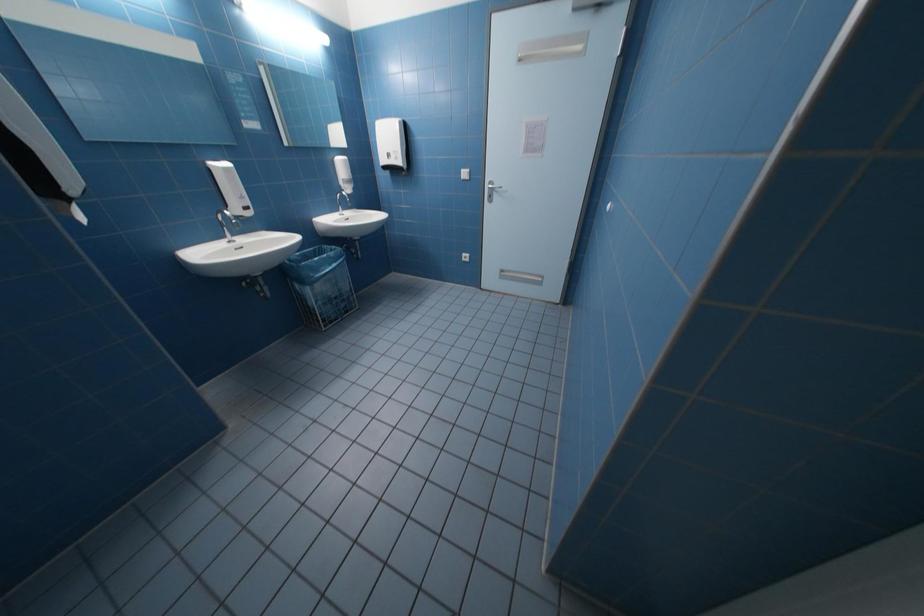
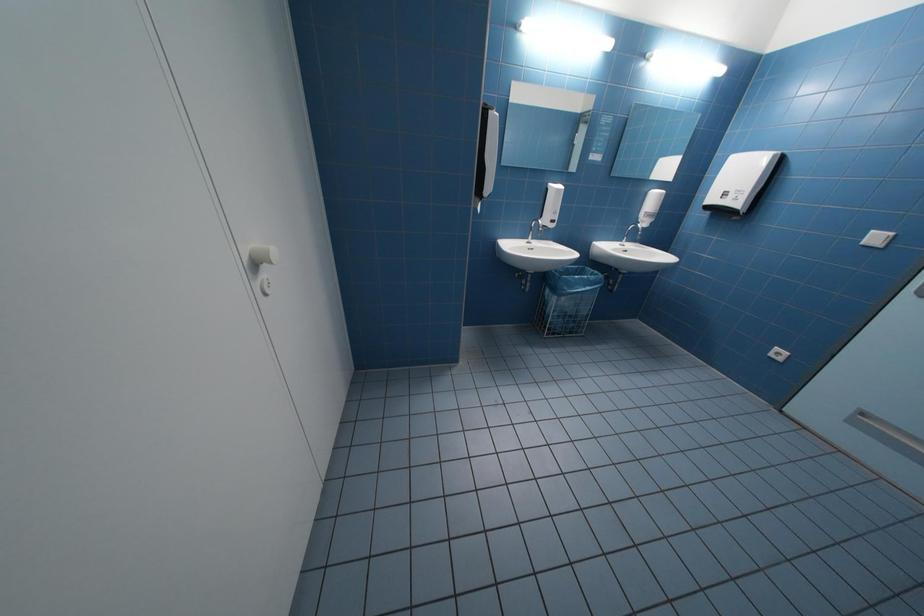
Question: The first image is from the beginning of the video and the second image is from the end. How did the camera likely rotate when shooting the video?

Choices:
 (A) Left
 (B) Right
 (C) Up
 (D) Down

Answer: (A)